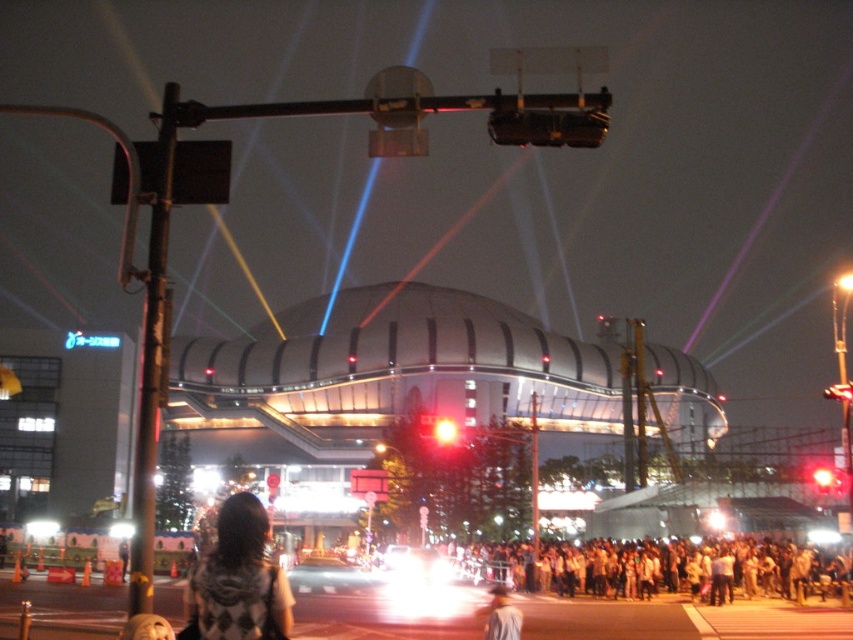
You are standing at the point marked as point (457, 429) in the image. The event organizers have placed a safety barrier 100 meters away from this point. Is the barrier within your immediate vicinity?

The point (457, 429) is 103.15 meters away from the viewer. Since the safety barrier is placed 100 meters away from this point, it is slightly beyond the immediate vicinity, as the distance exceeds 100 meters.

You are a photographer standing at the camera position. You want to take a photo of the metallic traffic light at upper left. Is the traffic light within your camera lens range? The camera can capture objects up to 50 meters away.

The metallic traffic light at upper left and camera are 49.75 meters apart, so yes, the metallic traffic light at upper left is within the camera lens range since it is within the 50 meters limit.